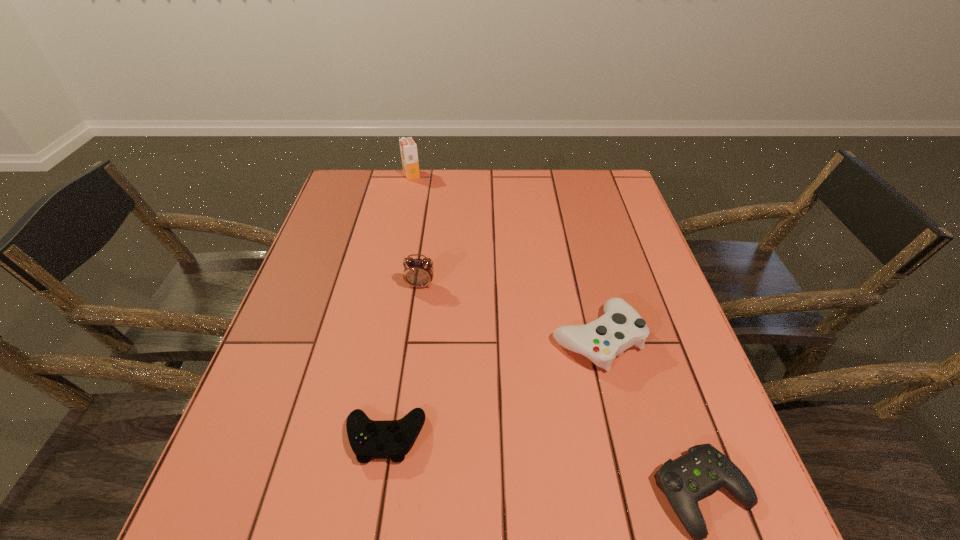
This screenshot has width=960, height=540. I want to click on vacant region located on the left of the leftmost control, so click(x=244, y=437).

The image size is (960, 540). I want to click on object at the far edge, so click(x=408, y=148).

Where is `object that is at the right edge`? This screenshot has width=960, height=540. object that is at the right edge is located at coordinates (621, 327).

At what (x,y) coordinates should I click in order to perform the action: click on free region at the near edge. Please return your answer as a coordinate pair (x, y). The width and height of the screenshot is (960, 540). Looking at the image, I should click on (565, 513).

The width and height of the screenshot is (960, 540). In the image, there is a desktop. Identify the location of vacant space at the left edge. (340, 343).

At what (x,y) coordinates should I click in order to perform the action: click on free space at the right edge of the desktop. Please return your answer as a coordinate pair (x, y). Looking at the image, I should click on (625, 280).

In the image, there is a desktop. At what (x,y) coordinates should I click in order to perform the action: click on vacant space at the far right corner. Please return your answer as a coordinate pair (x, y). This screenshot has width=960, height=540. Looking at the image, I should click on (618, 183).

This screenshot has height=540, width=960. What are the coordinates of `free space at the near right corner of the desktop` in the screenshot? It's located at [756, 507].

Locate an element on the screen. The height and width of the screenshot is (540, 960). vacant area that lies between the farthest object and the leftmost control is located at coordinates (398, 306).

This screenshot has height=540, width=960. Find the location of `vacant area that lies between the tallest control and the leftmost control`. vacant area that lies between the tallest control and the leftmost control is located at coordinates (491, 388).